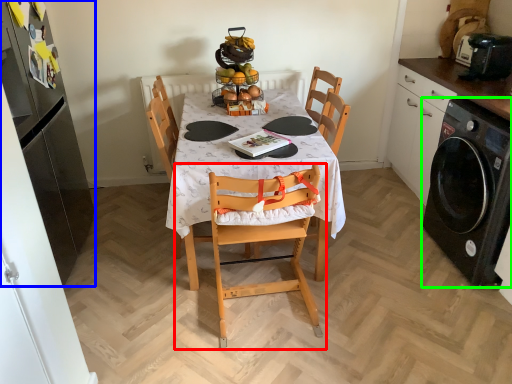
Question: Based on their relative distances, which object is nearer to chair (highlighted by a red box)? Choose from cabinetry (highlighted by a blue box) and kitchen appliance (highlighted by a green box).

Choices:
 (A) cabinetry
 (B) kitchen appliance

Answer: (B)